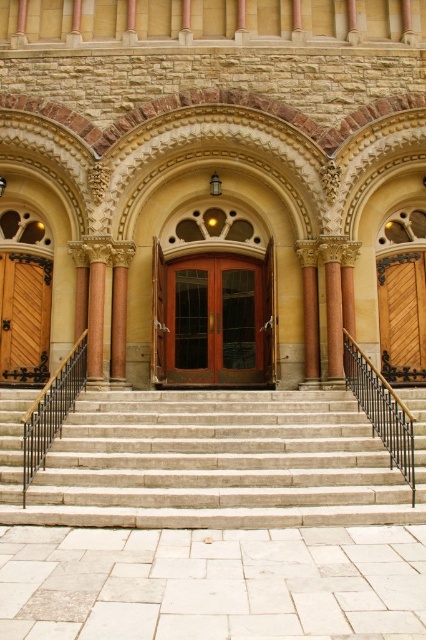
Question: Observing the image, what is the correct spatial positioning of wooden door at left in reference to wooden door at right?

Choices:
 (A) left
 (B) right

Answer: (A)

Question: Which object is the farthest from the wooden door at left?

Choices:
 (A) gray stone stairs at center
 (B) mahogany wood door at center
 (C) wooden door at right
 (D) polished bronze column at center

Answer: (C)

Question: Is wooden door at left positioned at the back of polished bronze column at center?

Choices:
 (A) yes
 (B) no

Answer: (A)

Question: Which of the following is the farthest from the observer?

Choices:
 (A) (388, 397)
 (B) (259, 374)
 (C) (112, 326)

Answer: (B)

Question: Which is farther from the mahogany wood door at center?

Choices:
 (A) polished bronze column at center
 (B) wooden door at right
 (C) black wrought iron railing at center
 (D) gray stone stairs at center

Answer: (B)

Question: Observing the image, what is the correct spatial positioning of wooden door at right in reference to black wrought iron railing at center?

Choices:
 (A) right
 (B) left

Answer: (A)